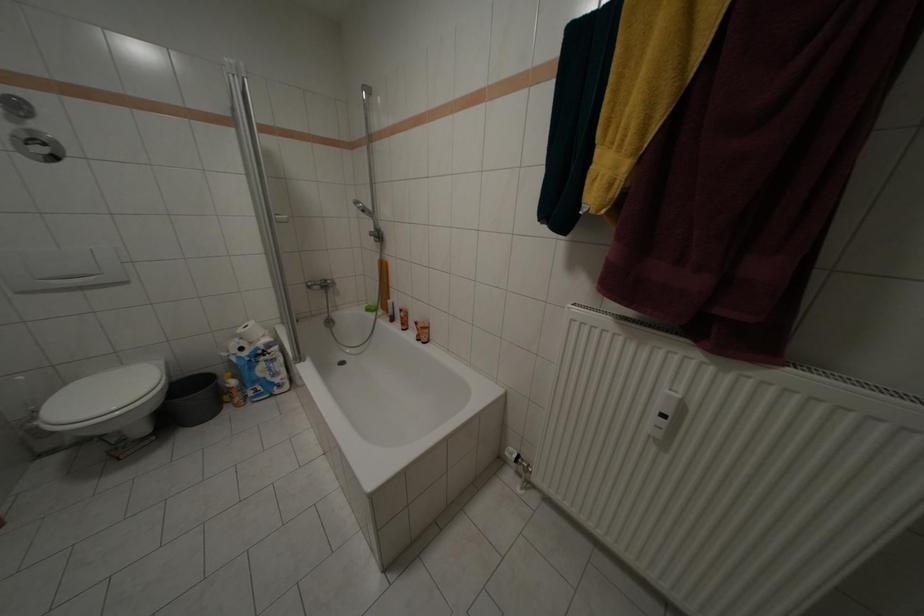
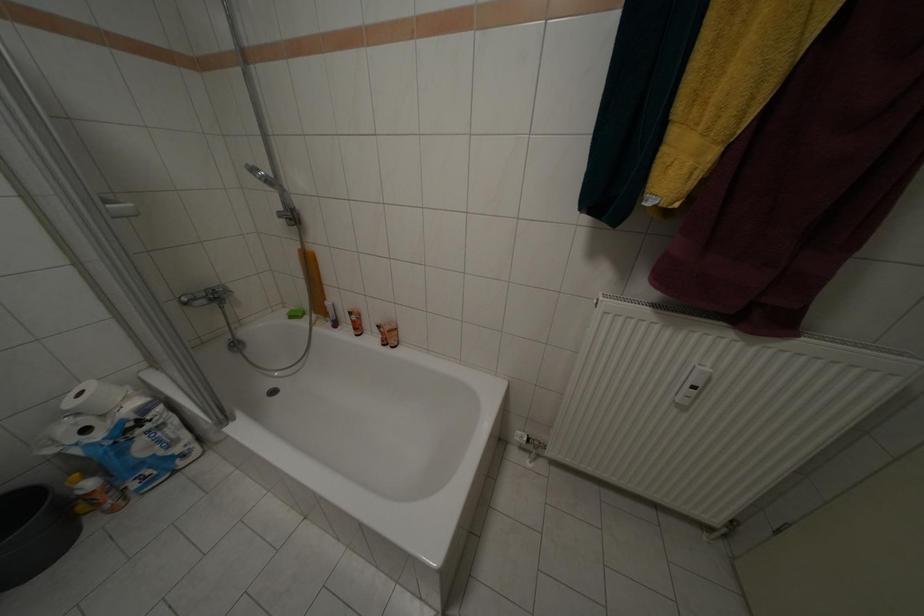
Which direction would the cameraman need to move to produce the second image?

The cameraman walked toward left, forward.